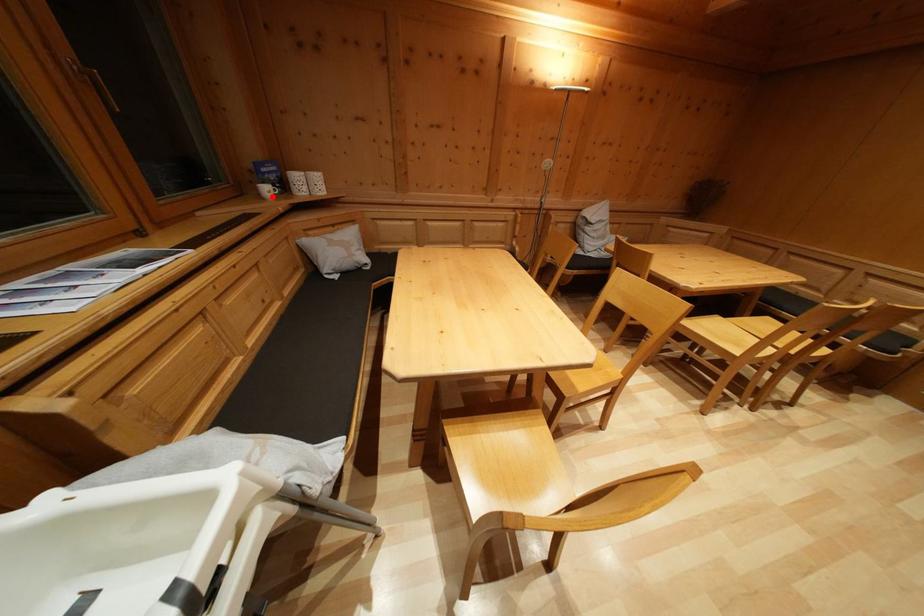
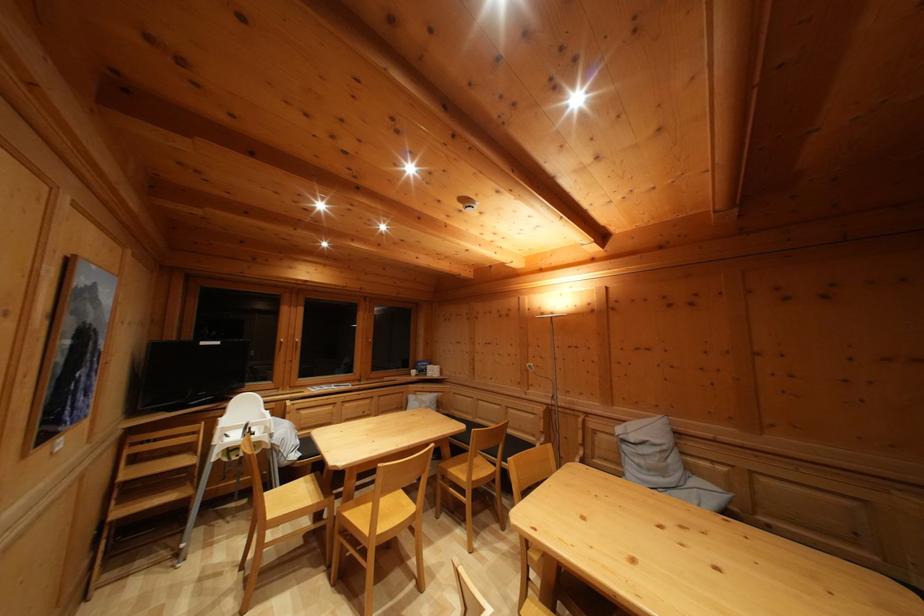
In the second image, find the point that corresponds to the highlighted location in the first image.

(419, 379)